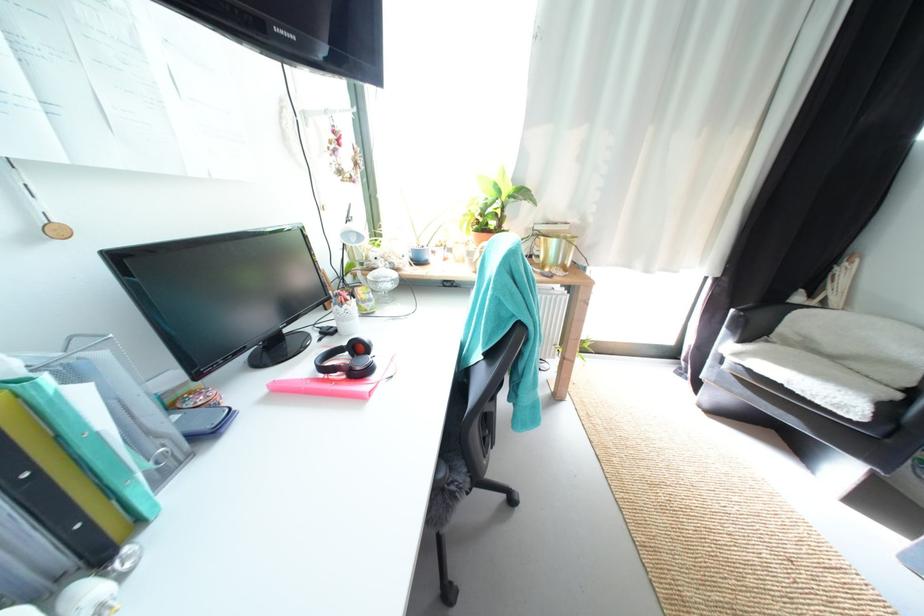
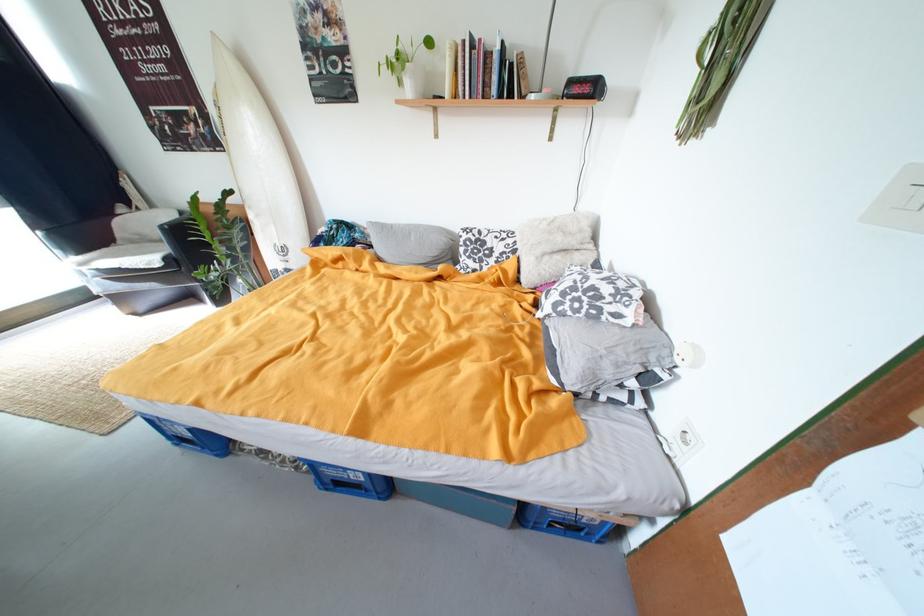
The point at (842, 360) is marked in the first image. Where is the corresponding point in the second image?

(169, 243)